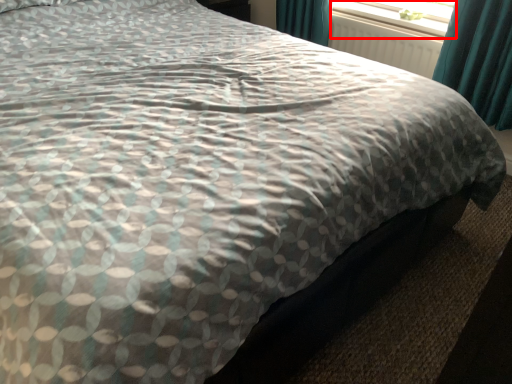
Question: From the image, what is the correct spatial relationship of window screen (annotated by the red box) in relation to radiator?

Choices:
 (A) right
 (B) left

Answer: (A)